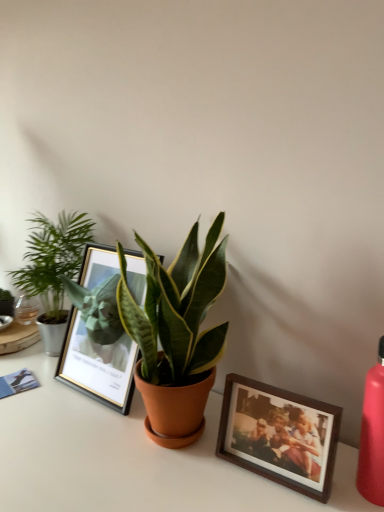
Question: In terms of width, does green glossy houseplant at center, which ranks as the second houseplant in left-to-right order, look wider or thinner when compared to green leafy plant at left, the second houseplant when ordered from front to back?

Choices:
 (A) thin
 (B) wide

Answer: (B)

Question: From a real-world perspective, is green glossy houseplant at center, which appears as the 2th houseplant when viewed from the back, physically located above or below green leafy plant at left, which ranks as the 1th houseplant in left-to-right order?

Choices:
 (A) below
 (B) above

Answer: (B)

Question: Based on their relative distances, which object is nearer to the green glossy houseplant at center, which appears as the 2th houseplant when viewed from the back?

Choices:
 (A) metallic gold picture frame at center, which is the 2th picture frame in front-to-back order
 (B) green leafy plant at left, marked as the 2th houseplant in a right-to-left arrangement
 (C) white glossy table at center
 (D) wooden photo frame at lower right, the second picture frame when ordered from back to front
 (E) matte red bottle at right

Answer: (A)

Question: Estimate the real-world distances between objects in this image. Which object is closer to the wooden photo frame at lower right, the second picture frame when ordered from back to front?

Choices:
 (A) matte red bottle at right
 (B) white glossy table at center
 (C) metallic gold picture frame at center, which is the 2th picture frame in front-to-back order
 (D) green leafy plant at left, which appears as the first houseplant when viewed from the back
 (E) green glossy houseplant at center, which appears as the 2th houseplant when viewed from the back

Answer: (A)